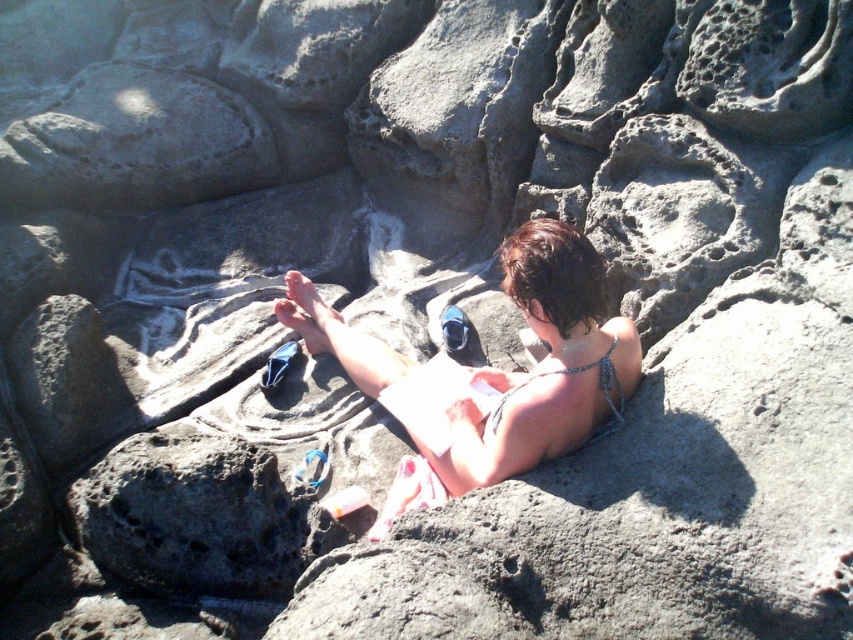
Which is in front, point (461, 429) or point (621, 419)?

Positioned in front is point (621, 419).

Is point (361, 353) farther from camera compared to point (506, 396)?

That is True.

Where is `white fabric bikini at center`? This screenshot has width=853, height=640. white fabric bikini at center is located at coordinates (532, 374).